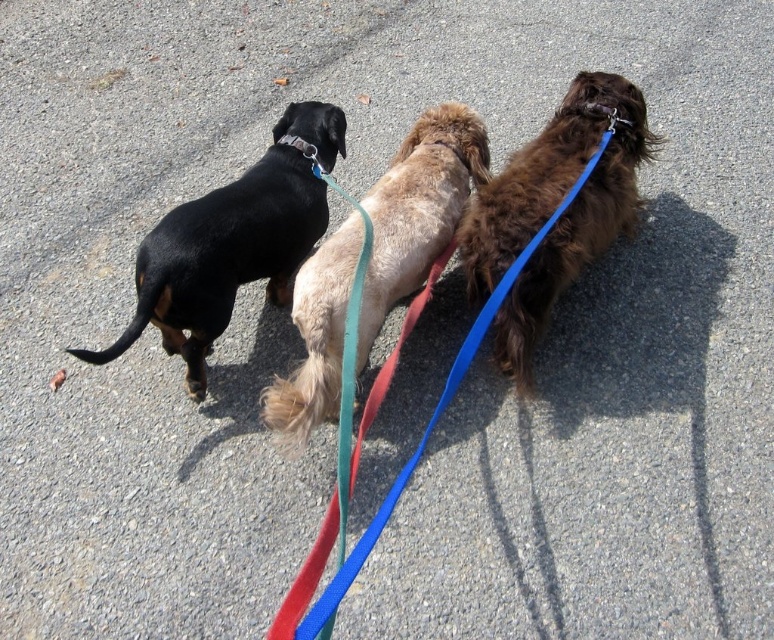
You are a dog walker holding a measuring tape. You need to ensure the metallic silver neckband at upper center can fit around the fuzzy beige dog at center. Is the neckband wide enough?

The fuzzy beige dog at center is wider than the metallic silver neckband at upper center, so the neckband may not be wide enough to comfortably fit around the dog.

You are a photographer standing in front of the three dogs. You want to take a photo of the metallic silver neckband at upper center without including the fuzzy beige dog at center in the frame. Is this possible given their positions?

The fuzzy beige dog at center is to the right of the metallic silver neckband at upper center. Since the dog is positioned to the right of the neckband, you can adjust your angle or zoom in to capture the metallic silver neckband at upper center while excluding the fuzzy beige dog at center from the shot.

Consider the image. Where is the black matte dog at left located in the image?

The black matte dog at left is located at point 0.383 on the horizontal axis and 0.300 on the vertical axis.